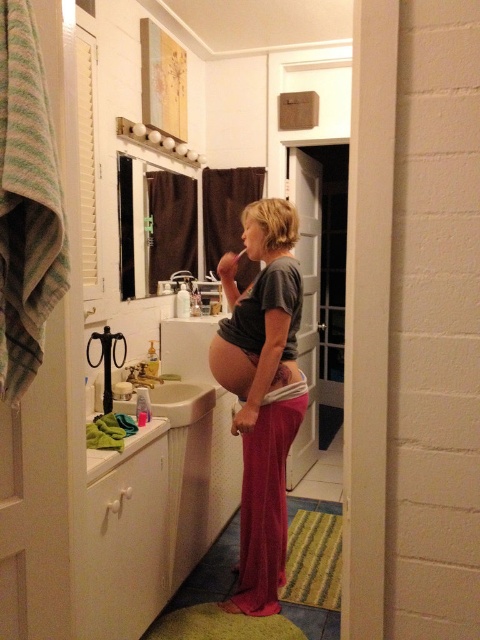
You are standing in the bathroom and want to reach both points mentioned. Which point is closer to you, point (100, 376) or point (137, 369)?

Point (100, 376) is closer to the camera than point (137, 369), so it is closer to you.

You are trying to decide whether to place a new decorative item on the matte gray shirt at center or the white glossy sink at lower left. Based on their sizes, which surface can accommodate a wider object?

The white glossy sink at lower left can accommodate a wider object since the matte gray shirt at center is thinner than it.